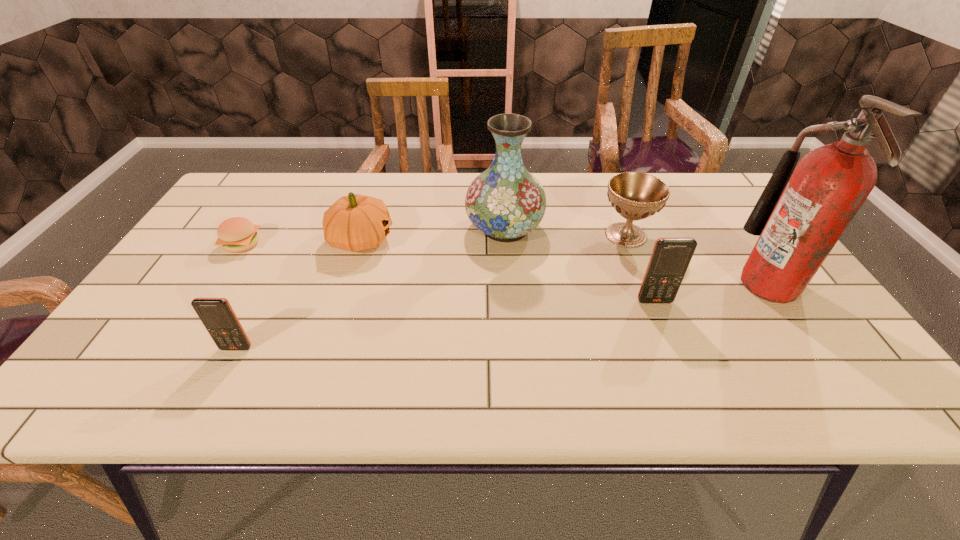
The height and width of the screenshot is (540, 960). Find the location of `the left cellular telephone`. the left cellular telephone is located at coordinates (218, 317).

This screenshot has width=960, height=540. What are the coordinates of `the shorter cellular telephone` in the screenshot? It's located at (218, 317).

This screenshot has width=960, height=540. Identify the location of the taller cellular telephone. (670, 258).

Where is `the farther cellular telephone`? This screenshot has height=540, width=960. the farther cellular telephone is located at coordinates (670, 258).

Image resolution: width=960 pixels, height=540 pixels. What are the coordinates of `the sixth shortest object` in the screenshot? It's located at (505, 202).

Where is `the fourth object from right to left`? The image size is (960, 540). the fourth object from right to left is located at coordinates (505, 202).

The height and width of the screenshot is (540, 960). Find the location of `the shortest object`. the shortest object is located at coordinates (237, 234).

This screenshot has height=540, width=960. I want to click on hamburger, so click(237, 234).

I want to click on gourd, so click(356, 222).

The height and width of the screenshot is (540, 960). Identify the location of fire extinguisher. (799, 217).